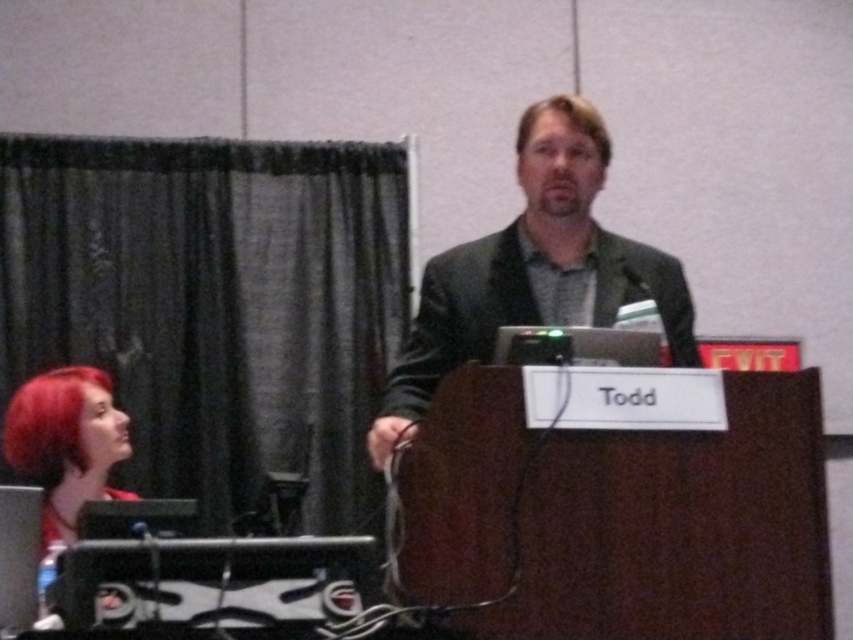
Question: Which object is farther from the camera taking this photo?

Choices:
 (A) dark gray suit at center
 (B) shiny red hair at lower left

Answer: (B)

Question: Does dark gray suit at center lie in front of blonde hair at center?

Choices:
 (A) yes
 (B) no

Answer: (A)

Question: Can you confirm if dark gray suit at center is bigger than blonde hair at center?

Choices:
 (A) no
 (B) yes

Answer: (B)

Question: Does shiny red hair at lower left have a smaller size compared to blonde hair at center?

Choices:
 (A) yes
 (B) no

Answer: (B)

Question: Which of the following is the closest to the observer?

Choices:
 (A) blonde hair at center
 (B) shiny red hair at lower left

Answer: (A)

Question: Which object appears closest to the camera in this image?

Choices:
 (A) dark gray suit at center
 (B) shiny red hair at lower left

Answer: (A)